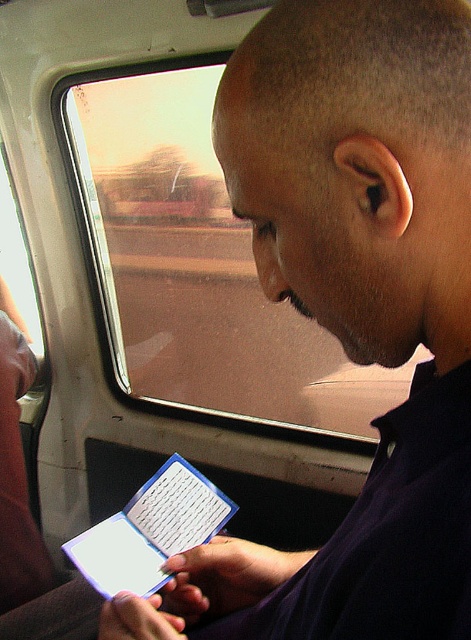
You are a passenger on a train and you have a blue plastic tablet at center that you want to place on the transparent glass train window at center. Can you place it there without it falling off?

The transparent glass train window at center is 3.50 meters away from the blue plastic tablet at center. Since the window is vertical and the tablet is placed at center, the tablet would slide down due to gravity and fall off unless secured. Therefore, it is not advisable to place the blue plastic tablet at center on the transparent glass train window at center.

You are a passenger on a train and need to check the time on your blue plastic tablet at center. To do this, you must first ensure that the transparent glass train window at center isn

The transparent glass train window at center is to the left of the blue plastic tablet at center, so you should look to the left side of the blue plastic tablet at center to find the window.

You are a passenger on a train and you have a blue plastic tablet at center. You want to look outside through the transparent glass train window at center. Can you hold your tablet up to the window without it blocking your view?

The transparent glass train window at center is taller than the blue plastic tablet at center, so yes, you can hold the blue plastic tablet at center up to the window without it blocking your entire view.